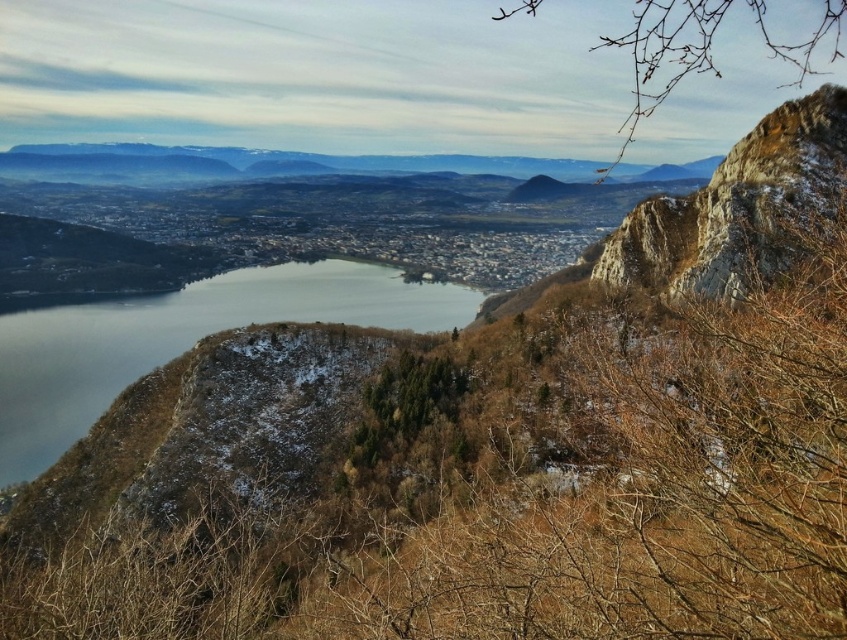
Question: Is clear glass water at center below rocky cliff at upper right?

Choices:
 (A) yes
 (B) no

Answer: (A)

Question: Can you confirm if clear glass water at center is bigger than rocky cliff at upper right?

Choices:
 (A) yes
 (B) no

Answer: (A)

Question: Does clear glass water at center appear on the left side of rocky cliff at upper right?

Choices:
 (A) yes
 (B) no

Answer: (A)